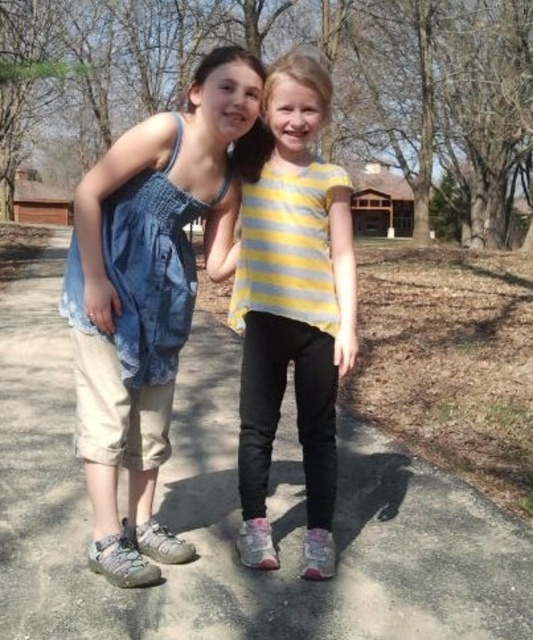
Question: Which object is the farthest from the yellow striped shirt at center?

Choices:
 (A) smooth concrete path at center
 (B) denim fabric at center

Answer: (A)

Question: Which of the following is the farthest from the observer?

Choices:
 (A) yellow striped shirt at center
 (B) smooth concrete path at center

Answer: (B)

Question: Does denim fabric at center have a larger size compared to yellow striped shirt at center?

Choices:
 (A) no
 (B) yes

Answer: (B)

Question: Is denim fabric at center above yellow striped shirt at center?

Choices:
 (A) yes
 (B) no

Answer: (A)

Question: Is smooth concrete path at center positioned behind yellow striped shirt at center?

Choices:
 (A) yes
 (B) no

Answer: (A)

Question: Estimate the real-world distances between objects in this image. Which object is closer to the smooth concrete path at center?

Choices:
 (A) yellow striped shirt at center
 (B) denim fabric at center

Answer: (B)